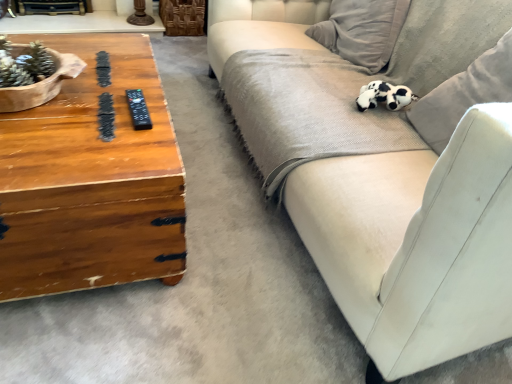
You are a GUI agent. You are given a task and a screenshot of the screen. Output one action in this format:
    pyautogui.click(x=<x>, y=<y>)
    Task: Click on the free space to the back side of black plastic remote at left
    
    Given the screenshot: What is the action you would take?
    pyautogui.click(x=142, y=83)